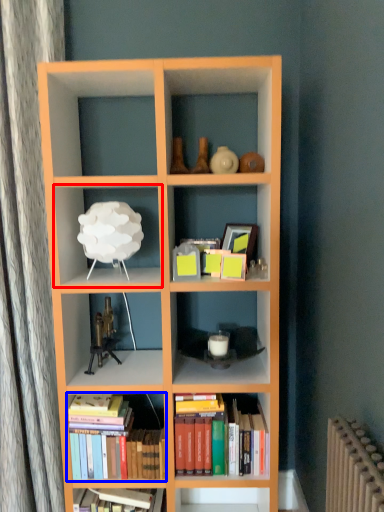
Question: Which object is further to the camera taking this photo, shelf (highlighted by a red box) or book (highlighted by a blue box)?

Choices:
 (A) shelf
 (B) book

Answer: (B)